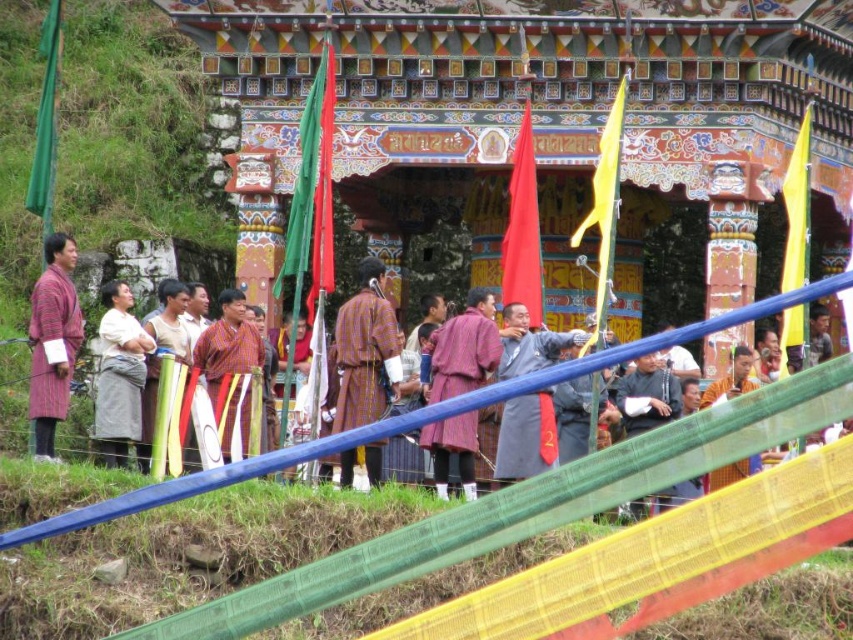
The width and height of the screenshot is (853, 640). What do you see at coordinates (366, 352) in the screenshot?
I see `yellow-orange fabric robe at center` at bounding box center [366, 352].

Between yellow-orange fabric robe at center and orange fabric at lower right, which one appears on the left side from the viewer's perspective?

Positioned to the left is yellow-orange fabric robe at center.

The width and height of the screenshot is (853, 640). In order to click on yellow-orange fabric robe at center in this screenshot , I will do `click(366, 352)`.

Where is `yellow-orange fabric robe at center`? Image resolution: width=853 pixels, height=640 pixels. yellow-orange fabric robe at center is located at coordinates (366, 352).

Does point (339, 365) come closer to viewer compared to point (518, 362)?

No, it is behind (518, 362).

Is yellow-orange fabric robe at center to the left of matte gray robe at center from the viewer's perspective?

Yes, yellow-orange fabric robe at center is to the left of matte gray robe at center.

Does point (335, 358) lie behind point (520, 476)?

Yes, point (335, 358) is farther from viewer.

At what (x,y) coordinates should I click in order to perform the action: click on yellow-orange fabric robe at center. Please return your answer as a coordinate pair (x, y). The width and height of the screenshot is (853, 640). Looking at the image, I should click on (366, 352).

Does matte gray robe at center have a smaller size compared to matte purple robe at center?

No.

Does matte gray robe at center have a greater width compared to matte purple robe at center?

Yes.

Between point (506, 368) and point (424, 448), which one is positioned in front?

Positioned in front is point (424, 448).

Identify the location of matte gray robe at center. The width and height of the screenshot is (853, 640). (526, 436).